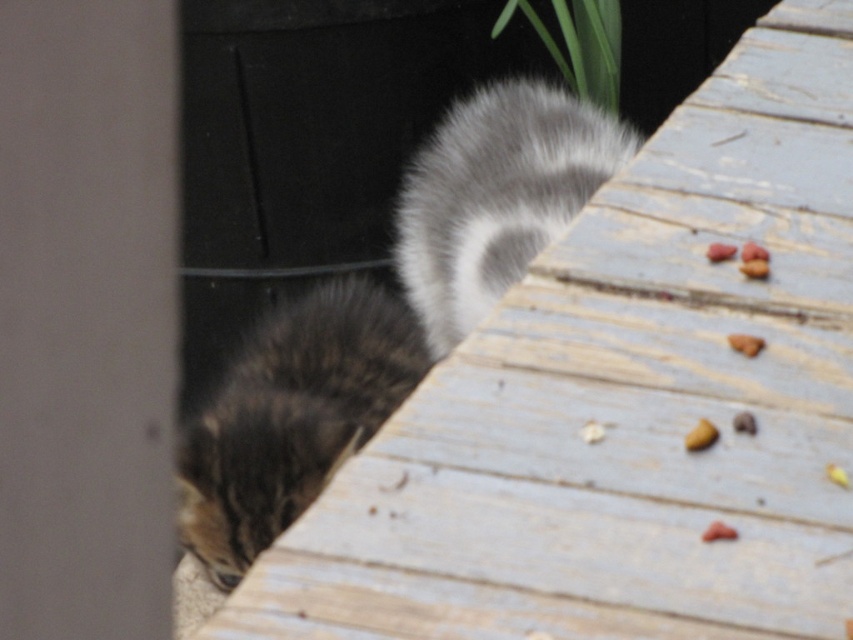
You are a cat owner who wants to ensure your cat stays hydrated. You have a water bowl placed exactly halfway between the tabby fur cat at lower left and the brown crumbly food at right. Is the water bowl closer to the cat or the food?

The water bowl is placed exactly halfway between the tabby fur cat at lower left and the brown crumbly food at right, which are 34.61 inches apart. Since the distance is equal, the water bowl is equidistant from both the cat and the food.

You are a cat observing the yellow matte food at lower right and the brown crumbly food at right. Which food is closer to your left side?

The yellow matte food at lower right is to the left of brown crumbly food at right, so the yellow matte food at lower right is closer to your left side.